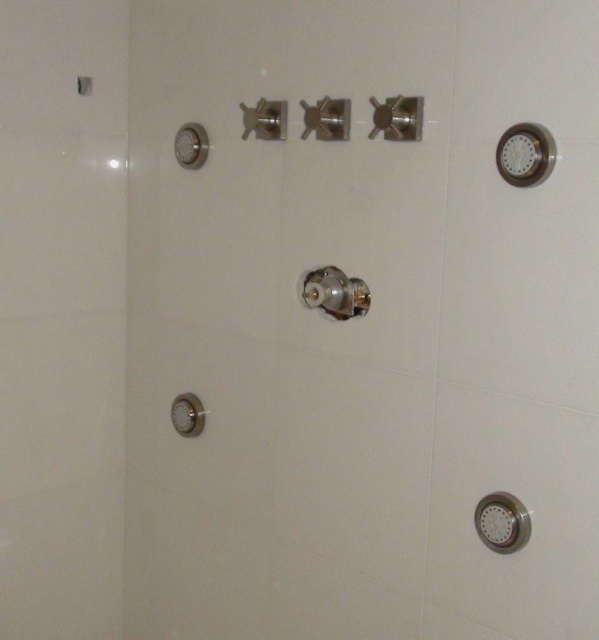
You are installing a new shower system and need to ensure that the polished chrome shower at center and the matte silver shower handle at lower left will fit within a 12 inch wide space. Based on their sizes, will both items fit side by side?

The polished chrome shower at center is wider than the matte silver shower handle at lower left. Since the total width of both items combined may exceed 12 inches, they might not fit side by side within the space.

You are installing a new shower system and need to ensure the polished chrome shower at center and the matte silver shower handle at lower left fit within a designated space. Which of the two fixtures is larger?

The polished chrome shower at center is bigger than the matte silver shower handle at lower left, so it requires more space.

Looking at this image, you are installing a new shelf on the wall and need to avoid the polished chrome shower at center. What are the coordinates where you should place the shelf to ensure it doesn not interfere with the shower?

The polished chrome shower at center is located at point (335, 292), so you should place the shelf at coordinates that do not overlap with this point to avoid interference.